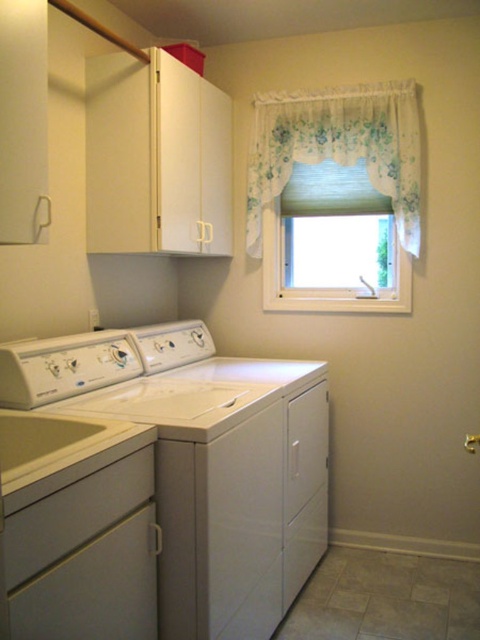
You are moving a small laundry basket that is 1.2 meters wide. You need to place it between the white glossy washing machine at lower left and the white matte washing machine at center. Can the basket fit in the space between them?

The white glossy washing machine at lower left might be wider than white matte washing machine at center, so the space between them may not be sufficient to fit the 1.2 meters wide laundry basket. It is possible that the basket will not fit properly due to the potential width difference.

You are moving a new laundry basket into the laundry room. The basket is 1 meter wide. You want to place it between the white matte washing machine at center and the floral lace curtain at upper center. Is there enough space for the basket?

The white matte washing machine at center is wider than the floral lace curtain at upper center. However, the exact distance between them isn t specified in the provided description. Without knowing the actual spacing, it s impossible to determine if the 1 meter wide basket will fit.